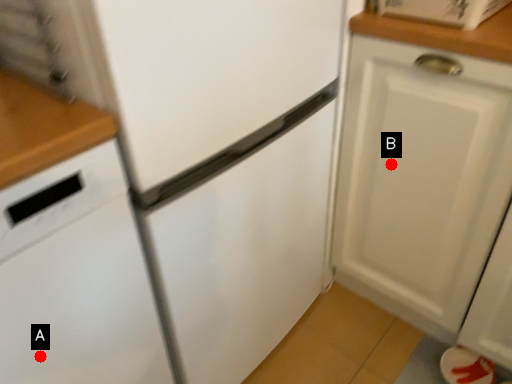
Question: Two points are circled on the image, labeled by A and B beside each circle. Which point is closer to the camera?

Choices:
 (A) A is closer
 (B) B is closer

Answer: (A)